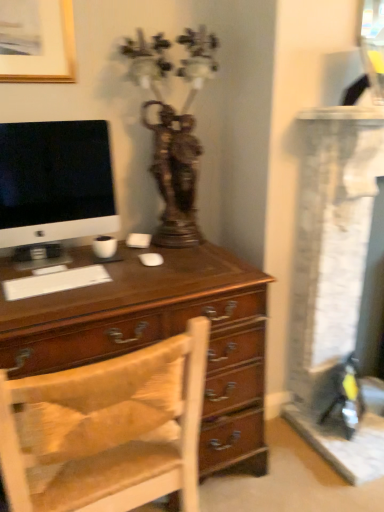
The image size is (384, 512). Describe the element at coordinates (174, 129) in the screenshot. I see `antique bronze statue at upper center` at that location.

Where is `antique bronze statue at upper center`? The height and width of the screenshot is (512, 384). antique bronze statue at upper center is located at coordinates (174, 129).

Does antique bronze statue at upper center appear on the right side of matte black monitor at left?

Yes, antique bronze statue at upper center is to the right of matte black monitor at left.

Considering the relative sizes of antique bronze statue at upper center and matte black monitor at left in the image provided, is antique bronze statue at upper center smaller than matte black monitor at left?

No, antique bronze statue at upper center is not smaller than matte black monitor at left.

How many degrees apart are the facing directions of antique bronze statue at upper center and matte black monitor at left?

The facing directions of antique bronze statue at upper center and matte black monitor at left are 1.12 degrees apart.

Is antique bronze statue at upper center wider or thinner than matte black monitor at left?

In the image, antique bronze statue at upper center appears to be wider than matte black monitor at left.

From a real-world perspective, between wooden chair at center and antique bronze statue at upper center, who is vertically higher?

In real-world perspective, antique bronze statue at upper center is above.

In terms of width, does wooden chair at center look wider or thinner when compared to antique bronze statue at upper center?

Considering their sizes, wooden chair at center looks broader than antique bronze statue at upper center.

Measure the distance from wooden chair at center to antique bronze statue at upper center.

wooden chair at center and antique bronze statue at upper center are 31.31 inches apart.

Considering the relative sizes of wooden chair at center and antique bronze statue at upper center in the image provided, is wooden chair at center smaller than antique bronze statue at upper center?

Actually, wooden chair at center might be larger than antique bronze statue at upper center.

Is matte black monitor at left beside wooden chair at center?

No, matte black monitor at left is not making contact with wooden chair at center.

Which is more to the right, matte black monitor at left or wooden chair at center?

wooden chair at center is more to the right.

Which point is more forward, (32,240) or (117,415)?

The point (117,415) is closer.

From a real-world perspective, is matte black monitor at left on wooden chair at center?

Indeed, from a real-world perspective, matte black monitor at left stands above wooden chair at center.

Is point (149, 46) behind point (14, 501)?

Yes, it is.

From the image's perspective, is antique bronze statue at upper center beneath wooden chair at center?

Incorrect, from the image's perspective, antique bronze statue at upper center is higher than wooden chair at center.

Is antique bronze statue at upper center located outside wooden chair at center?

antique bronze statue at upper center is positioned outside wooden chair at center.

Looking at this image, from a real-world perspective, who is located higher, gold-framed picture at upper left or antique bronze statue at upper center?

gold-framed picture at upper left is physically above.

Do you think gold-framed picture at upper left is within antique bronze statue at upper center, or outside of it?

gold-framed picture at upper left is outside antique bronze statue at upper center.

Is gold-framed picture at upper left turned away from antique bronze statue at upper center?

gold-framed picture at upper left does not have its back to antique bronze statue at upper center.

Which object is positioned more to the right, gold-framed picture at upper left or antique bronze statue at upper center?

antique bronze statue at upper center.

Can you tell me how much wooden chair at center and matte black monitor at left differ in facing direction?

The angular difference between wooden chair at center and matte black monitor at left is 180 degrees.

Is wooden chair at center smaller than matte black monitor at left?

Incorrect, wooden chair at center is not smaller in size than matte black monitor at left.

Could you tell me if wooden chair at center is facing matte black monitor at left?

No, wooden chair at center does not turn towards matte black monitor at left.

Considering their positions, is wooden chair at center located in front of or behind matte black monitor at left?

Visually, wooden chair at center is located in front of matte black monitor at left.

Is gold-framed picture at upper left at the back of antique bronze statue at upper center?

No.

Looking at this image, is antique bronze statue at upper center situated inside gold-framed picture at upper left or outside?

antique bronze statue at upper center lies outside gold-framed picture at upper left.

Is the position of antique bronze statue at upper center more distant than that of gold-framed picture at upper left?

No, it is not.

Does point (183, 186) lie behind point (9, 73)?

Yes.

Image resolution: width=384 pixels, height=512 pixels. Find the location of `computer monitor below the antique bronze statue at upper center (from the image's perspective)`. computer monitor below the antique bronze statue at upper center (from the image's perspective) is located at coordinates (55, 182).

This screenshot has width=384, height=512. I want to click on antique behind the wooden chair at center, so click(x=174, y=129).

Considering their positions, is matte black monitor at left positioned closer to antique bronze statue at upper center than gold-framed picture at upper left?

Based on the image, matte black monitor at left appears to be nearer to antique bronze statue at upper center.

From the image, which object appears to be nearer to gold-framed picture at upper left, matte black monitor at left or wooden chair at center?

Based on the image, matte black monitor at left appears to be nearer to gold-framed picture at upper left.

Estimate the real-world distances between objects in this image. Which object is further from antique bronze statue at upper center, matte black monitor at left or wooden chair at center?

wooden chair at center lies further to antique bronze statue at upper center than the other object.

Estimate the real-world distances between objects in this image. Which object is further from gold-framed picture at upper left, antique bronze statue at upper center or wooden chair at center?

Based on the image, wooden chair at center appears to be further to gold-framed picture at upper left.

Looking at the image, which one is located further to gold-framed picture at upper left, antique bronze statue at upper center or matte black monitor at left?

antique bronze statue at upper center is positioned further to the anchor gold-framed picture at upper left.

Which object lies nearer to the anchor point matte black monitor at left, antique bronze statue at upper center or gold-framed picture at upper left?

Among the two, antique bronze statue at upper center is located nearer to matte black monitor at left.

When comparing their distances from gold-framed picture at upper left, does wooden chair at center or matte black monitor at left seem closer?

Based on the image, matte black monitor at left appears to be nearer to gold-framed picture at upper left.

Looking at the image, which one is located closer to wooden chair at center, antique bronze statue at upper center or matte black monitor at left?

matte black monitor at left.

Locate an element on the screen. antique between gold-framed picture at upper left and wooden chair at center from top to bottom is located at coordinates (174, 129).

Locate an element on the screen. computer monitor between antique bronze statue at upper center and wooden chair at center in the vertical direction is located at coordinates (55, 182).

The width and height of the screenshot is (384, 512). In order to click on antique between gold-framed picture at upper left and matte black monitor at left from top to bottom in this screenshot , I will do `click(174, 129)`.

Image resolution: width=384 pixels, height=512 pixels. Identify the location of computer monitor between gold-framed picture at upper left and wooden chair at center from top to bottom. (55, 182).